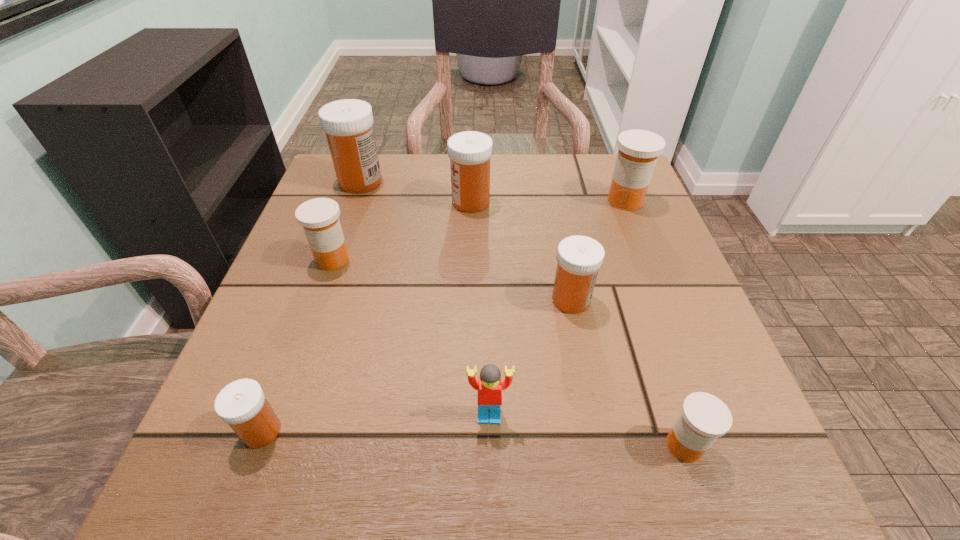
You are a GUI agent. You are given a task and a screenshot of the screen. Output one action in this format:
    pyautogui.click(x=<x>, y=<y>)
    Task: Click on the tallest medicine
    
    Given the screenshot: What is the action you would take?
    pyautogui.click(x=348, y=124)

Find the location of a particular element. The width and height of the screenshot is (960, 540). the biggest white medicine is located at coordinates (348, 124).

Find the location of a particular element. This screenshot has width=960, height=540. the biggest orange medicine is located at coordinates (638, 151).

You are a GUI agent. You are given a task and a screenshot of the screen. Output one action in this format:
    pyautogui.click(x=<x>, y=<y>)
    Task: Click on the fourth medicine from right to left
    This screenshot has width=960, height=540.
    Given the screenshot: What is the action you would take?
    pyautogui.click(x=469, y=151)

Image resolution: width=960 pixels, height=540 pixels. Find the location of `the third white medicine from left to right`. the third white medicine from left to right is located at coordinates (469, 151).

Find the location of a particular element. the second nearest orange medicine is located at coordinates (319, 217).

At what (x,y) coordinates should I click in order to perform the action: click on the fifth nearest object. Please return your answer as a coordinate pair (x, y). The height and width of the screenshot is (540, 960). Looking at the image, I should click on (319, 217).

Where is `the third nearest medicine`? the third nearest medicine is located at coordinates (579, 258).

Where is `the rightmost white medicine`? the rightmost white medicine is located at coordinates coord(579,258).

Locate an element on the screen. The width and height of the screenshot is (960, 540). Lego is located at coordinates (489, 387).